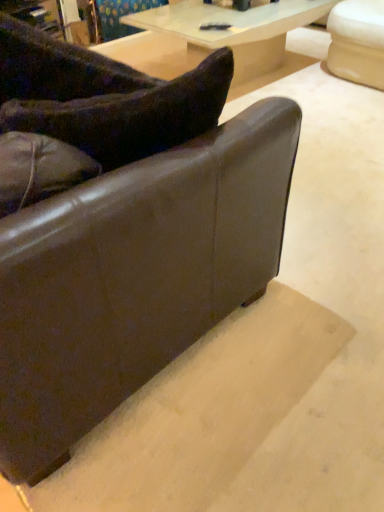
Question: From a real-world perspective, is translucent glass table at upper center over velvety dark brown pillow at upper left?

Choices:
 (A) no
 (B) yes

Answer: (A)

Question: From the image's perspective, is translucent glass table at upper center on velvety dark brown pillow at upper left?

Choices:
 (A) no
 (B) yes

Answer: (B)

Question: Considering the relative sizes of translucent glass table at upper center and velvety dark brown pillow at upper left in the image provided, is translucent glass table at upper center shorter than velvety dark brown pillow at upper left?

Choices:
 (A) no
 (B) yes

Answer: (A)

Question: Is translucent glass table at upper center thinner than velvety dark brown pillow at upper left?

Choices:
 (A) yes
 (B) no

Answer: (B)

Question: Can velvety dark brown pillow at upper left be found inside translucent glass table at upper center?

Choices:
 (A) yes
 (B) no

Answer: (B)

Question: Relative to brown leather couch at lower left, is velvety dark brown pillow at upper left in front or behind?

Choices:
 (A) front
 (B) behind

Answer: (B)

Question: Choose the correct answer: Is velvety dark brown pillow at upper left inside brown leather couch at lower left or outside it?

Choices:
 (A) outside
 (B) inside

Answer: (B)

Question: From the image's perspective, is velvety dark brown pillow at upper left located above or below brown leather couch at lower left?

Choices:
 (A) above
 (B) below

Answer: (B)

Question: Based on their positions, is velvety dark brown pillow at upper left located to the left or right of brown leather couch at lower left?

Choices:
 (A) left
 (B) right

Answer: (B)

Question: Looking at their shapes, would you say brown leather couch at lower left is wider or thinner than translucent glass table at upper center?

Choices:
 (A) wide
 (B) thin

Answer: (A)

Question: From the image's perspective, relative to translucent glass table at upper center, is brown leather couch at lower left above or below?

Choices:
 (A) below
 (B) above

Answer: (A)

Question: Is brown leather couch at lower left in front of or behind translucent glass table at upper center in the image?

Choices:
 (A) front
 (B) behind

Answer: (A)

Question: From a real-world perspective, is brown leather couch at lower left physically located above or below translucent glass table at upper center?

Choices:
 (A) above
 (B) below

Answer: (A)

Question: Based on their positions, is translucent glass table at upper center located to the left or right of brown leather couch at lower left?

Choices:
 (A) left
 (B) right

Answer: (B)

Question: In terms of size, does translucent glass table at upper center appear bigger or smaller than brown leather couch at lower left?

Choices:
 (A) small
 (B) big

Answer: (A)